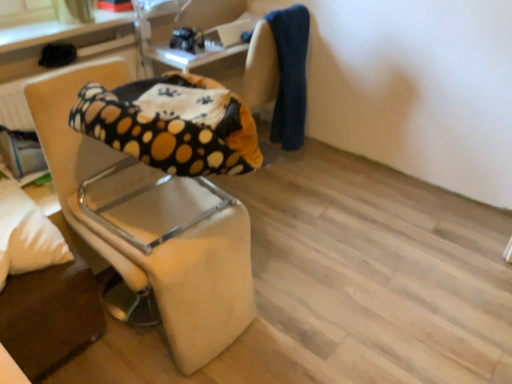
Question: From a real-world perspective, is beige fabric chair at left positioned above or below white soft pillow at lower left?

Choices:
 (A) above
 (B) below

Answer: (B)

Question: In terms of height, does beige fabric chair at left look taller or shorter compared to white soft pillow at lower left?

Choices:
 (A) tall
 (B) short

Answer: (A)

Question: From the image's perspective, is beige fabric chair at left positioned above or below white soft pillow at lower left?

Choices:
 (A) below
 (B) above

Answer: (B)

Question: From the image's perspective, is white soft pillow at lower left positioned above or below beige fabric chair at left?

Choices:
 (A) above
 (B) below

Answer: (B)

Question: Considering the positions of point (10, 236) and point (228, 322), is point (10, 236) closer or farther from the camera than point (228, 322)?

Choices:
 (A) closer
 (B) farther

Answer: (A)

Question: In terms of height, does white soft pillow at lower left look taller or shorter compared to beige fabric chair at left?

Choices:
 (A) short
 (B) tall

Answer: (A)

Question: Is white soft pillow at lower left in front of or behind beige fabric chair at left in the image?

Choices:
 (A) behind
 (B) front

Answer: (A)